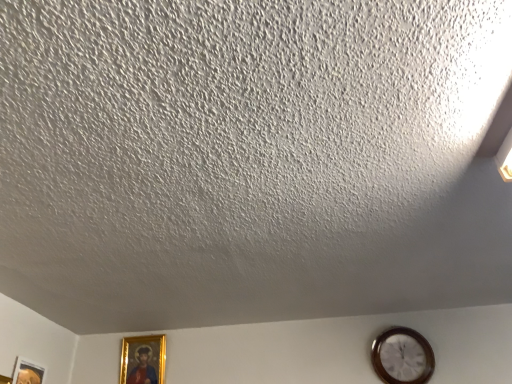
Question: Considering the relative sizes of matte gold picture frame at lower left, the 1th picture frame in the left-to-right sequence, and gold-framed picture at lower left, which appears as the 2th picture frame when viewed from the left, in the image provided, is matte gold picture frame at lower left, the 1th picture frame in the left-to-right sequence, bigger than gold-framed picture at lower left, which appears as the 2th picture frame when viewed from the left,?

Choices:
 (A) yes
 (B) no

Answer: (B)

Question: Is matte gold picture frame at lower left, the 1th picture frame in the left-to-right sequence, shorter than gold-framed picture at lower left, which is the 2th picture frame in front-to-back order?

Choices:
 (A) yes
 (B) no

Answer: (A)

Question: From a real-world perspective, is matte gold picture frame at lower left, the second picture frame when ordered from right to left, physically below gold-framed picture at lower left, which is the 2th picture frame in front-to-back order?

Choices:
 (A) yes
 (B) no

Answer: (A)

Question: Would you consider matte gold picture frame at lower left, which is the 1th picture frame in front-to-back order, to be distant from gold-framed picture at lower left, the first picture frame viewed from the back?

Choices:
 (A) yes
 (B) no

Answer: (B)

Question: Is matte gold picture frame at lower left, the 1th picture frame in the left-to-right sequence, thinner than gold-framed picture at lower left, the first picture frame viewed from the back?

Choices:
 (A) no
 (B) yes

Answer: (B)

Question: Is gold-framed picture at lower left, marked as the first picture frame in a right-to-left arrangement, bigger or smaller than matte gold picture frame at lower left, which is the 1th picture frame in front-to-back order?

Choices:
 (A) small
 (B) big

Answer: (B)

Question: From a real-world perspective, is gold-framed picture at lower left, the first picture frame viewed from the back, above or below matte gold picture frame at lower left, the second picture frame when ordered from right to left?

Choices:
 (A) above
 (B) below

Answer: (A)

Question: From the image's perspective, is gold-framed picture at lower left, which is the 2th picture frame in front-to-back order, located above or below matte gold picture frame at lower left, the 1th picture frame in the left-to-right sequence?

Choices:
 (A) above
 (B) below

Answer: (B)

Question: In the image, is gold-framed picture at lower left, which is the 2th picture frame in front-to-back order, positioned in front of or behind matte gold picture frame at lower left, the second picture frame when ordered from back to front?

Choices:
 (A) front
 (B) behind

Answer: (B)

Question: Is matte gold picture frame at lower left, which is the 1th picture frame in front-to-back order, in front of or behind gold-framed picture at lower left, which appears as the 2th picture frame when viewed from the left, in the image?

Choices:
 (A) behind
 (B) front

Answer: (B)

Question: Is matte gold picture frame at lower left, which is the 1th picture frame in front-to-back order, inside or outside of gold-framed picture at lower left, marked as the first picture frame in a right-to-left arrangement?

Choices:
 (A) outside
 (B) inside

Answer: (A)

Question: Is matte gold picture frame at lower left, the 1th picture frame in the left-to-right sequence, taller or shorter than gold-framed picture at lower left, marked as the first picture frame in a right-to-left arrangement?

Choices:
 (A) tall
 (B) short

Answer: (B)

Question: Is matte gold picture frame at lower left, which is the 1th picture frame in front-to-back order, to the left or to the right of gold-framed picture at lower left, which appears as the 2th picture frame when viewed from the left, in the image?

Choices:
 (A) right
 (B) left

Answer: (B)

Question: Considering their positions, is wooden wall clock at lower right located in front of or behind matte gold picture frame at lower left, the second picture frame when ordered from right to left?

Choices:
 (A) front
 (B) behind

Answer: (B)

Question: From the image's perspective, is wooden wall clock at lower right above or below matte gold picture frame at lower left, the second picture frame when ordered from back to front?

Choices:
 (A) below
 (B) above

Answer: (B)